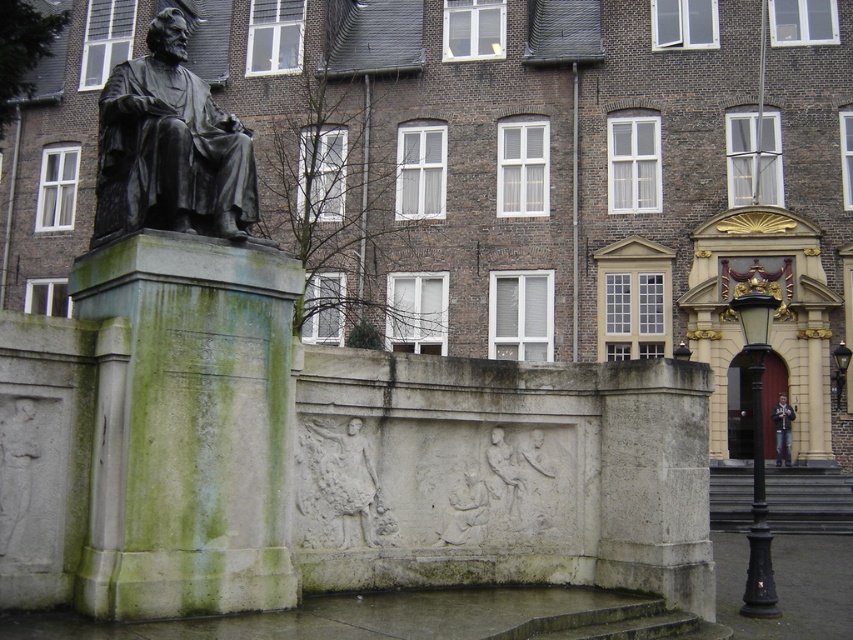
Between point (148, 52) and point (346, 522), which one is positioned behind?

The point (148, 52) is more distant.

The height and width of the screenshot is (640, 853). What do you see at coordinates (169, 147) in the screenshot?
I see `bronze statue at left` at bounding box center [169, 147].

Describe the element at coordinates (169, 147) in the screenshot. I see `bronze statue at left` at that location.

Identify the location of bronze statue at left. pos(169,147).

Is green mossy stone at left wider than bronze statue at left?

No, green mossy stone at left is not wider than bronze statue at left.

Which is above, green mossy stone at left or bronze statue at left?

bronze statue at left

Locate an element on the screen. green mossy stone at left is located at coordinates [x=189, y=426].

Image resolution: width=853 pixels, height=640 pixels. I want to click on green mossy stone at left, so click(x=189, y=426).

Which is above, green mossy stone at left or white stone relief at center?

Positioned higher is green mossy stone at left.

Between point (167, 496) and point (310, 426), which one is positioned behind?

Point (310, 426)

Where is `green mossy stone at left`? The height and width of the screenshot is (640, 853). green mossy stone at left is located at coordinates (189, 426).